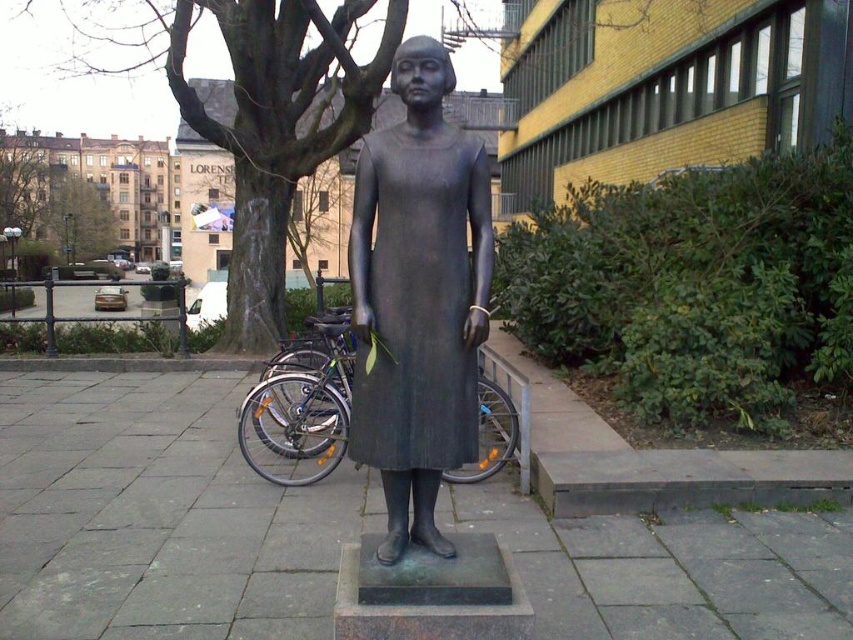
You are a photographer standing at a certain position to take a photo of the matte bronze statue at center. The statue is 7 feet tall. Can you estimate whether the statue will appear taller than the yellow building with dark framed windows in the background in the photo?

The matte bronze statue at center is 8.27 feet away from the camera, while the yellow building with dark framed windows is further away. Since the statue is closer to the camera than the building, it will appear taller in the photo despite its actual height being less than the building.

You are a photographer standing in front of the matte bronze statue at center and the dark brown bark tree at upper left. You want to take a photo that includes both subjects. Which subject should you focus on first to ensure both are in focus?

The matte bronze statue at center is closer to the viewer than the dark brown bark tree at upper left, so you should focus on the matte bronze statue at center first to ensure both are in focus.

Based on the scene description, where is the dark brown bark tree at upper left located in the image?

The dark brown bark tree at upper left is located at point (276, 125) in the image.